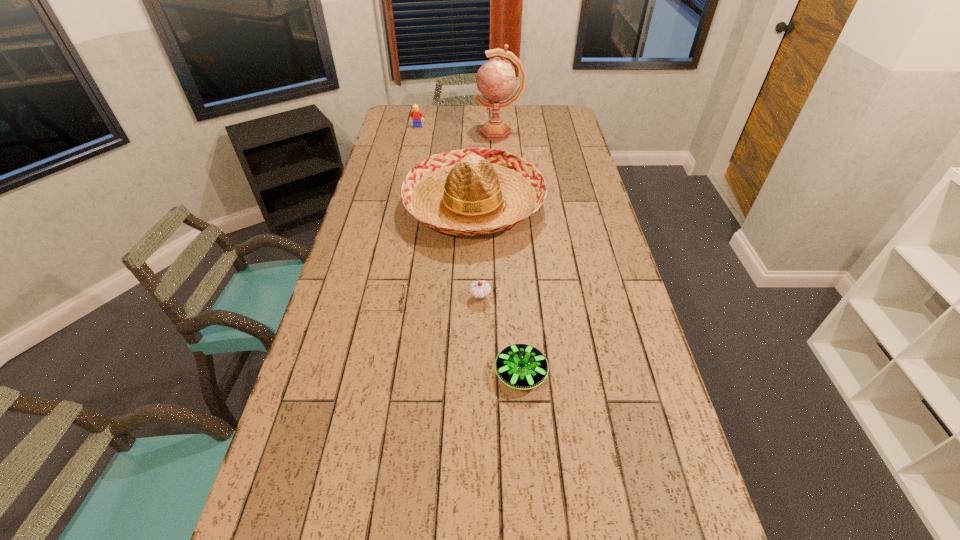
Locate an element on the screen. The height and width of the screenshot is (540, 960). free space in the image that satisfies the following two spatial constraints: 1. on the face of the cupcake; 2. on the right side of the Lego is located at coordinates (381, 297).